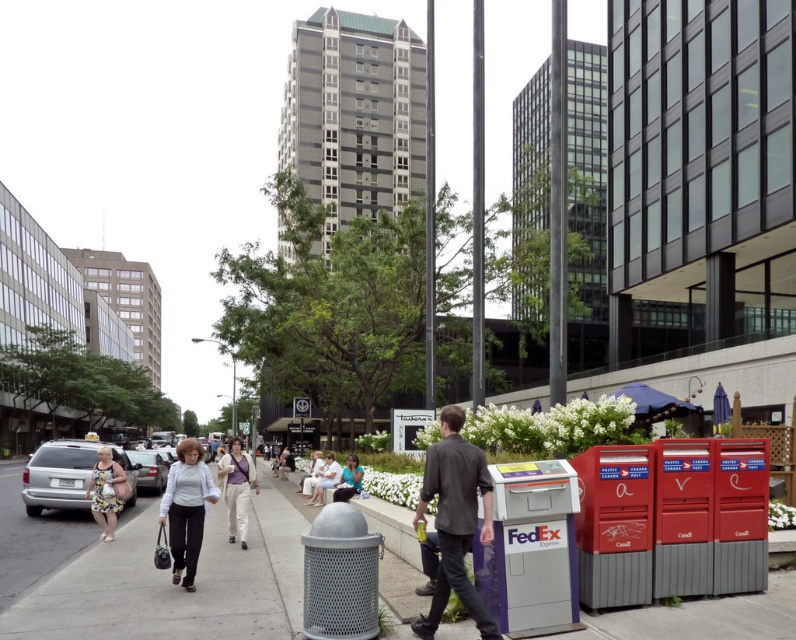
Question: Considering the real-world distances, which object is closest to the white cotton dress at center?

Choices:
 (A) light blue shirt at center
 (B) light beige pants at center
 (C) light gray fabric pants at lower left
 (D) floral dress at lower left

Answer: (A)

Question: Is light gray fabric pants at lower left below light beige pants at center?

Choices:
 (A) yes
 (B) no

Answer: (A)

Question: Which point is farther to the camera?

Choices:
 (A) (x=244, y=545)
 (B) (x=203, y=502)
 (C) (x=123, y=477)
 (D) (x=326, y=460)

Answer: (D)

Question: Which object is positioned closest to the light blue shirt at center?

Choices:
 (A) floral dress at lower left
 (B) light gray fabric pants at lower left

Answer: (B)

Question: Can you confirm if light gray fabric pants at lower left is bigger than light beige pants at center?

Choices:
 (A) no
 (B) yes

Answer: (B)

Question: Is dark gray textured blazer at center thinner than light gray fabric pants at lower left?

Choices:
 (A) yes
 (B) no

Answer: (A)